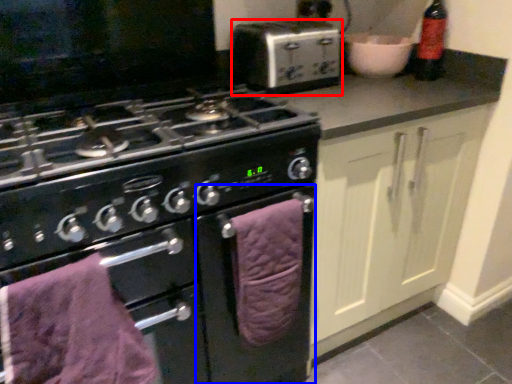
Question: Which point is further to the camera, kitchen appliance (highlighted by a red box) or oven (highlighted by a blue box)?

Choices:
 (A) kitchen appliance
 (B) oven

Answer: (A)